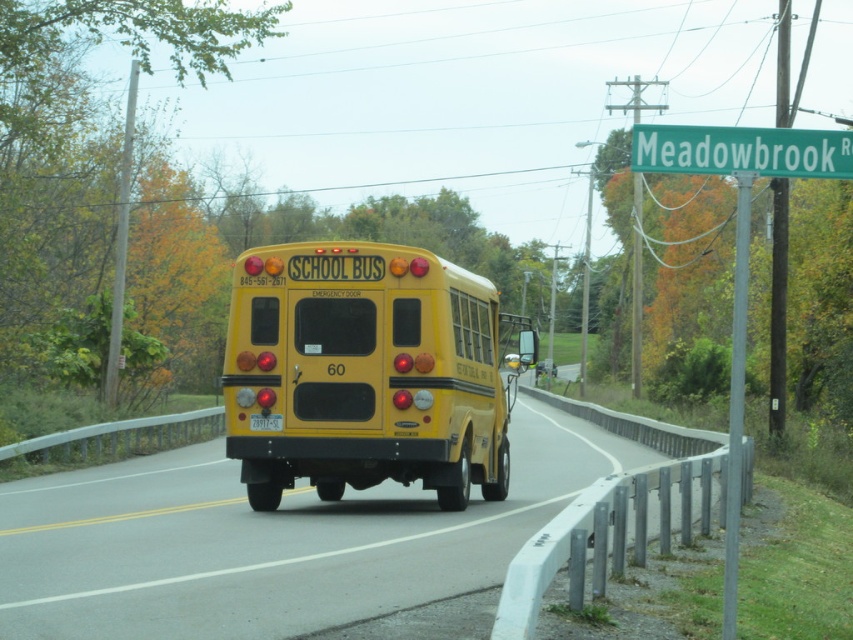
You are a pedestrian standing at the green plastic street sign at upper center, and you want to cross the road to reach the yellow matte school bus at center. The road is 10 meters wide. Can you safely cross the road before the bus moves forward?

The yellow matte school bus at center is 13.37 meters away from the green plastic street sign at upper center. Since the road is 10 meters wide, the distance between you and the bus is greater than the road width. Therefore, you can safely cross the road before the bus moves forward.